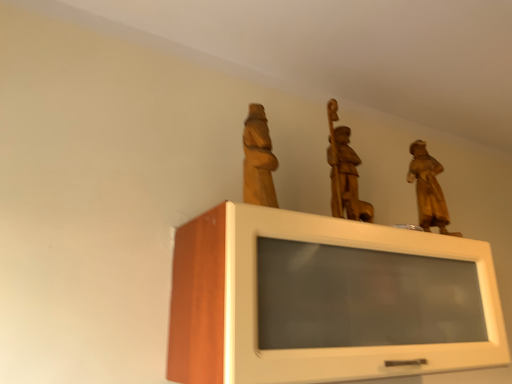
Identify the location of wooden statue at center, arranged as the 2th sculpture when viewed from the right. (344, 172).

Where is `wooden statue at upper right, arranged as the first sculpture when viewed from the right`? wooden statue at upper right, arranged as the first sculpture when viewed from the right is located at coordinates (428, 189).

At what (x,y) coordinates should I click in order to perform the action: click on white glossy cabinet at upper center. Please return your answer as a coordinate pair (x, y). This screenshot has width=512, height=384. Looking at the image, I should click on (325, 300).

Is wooden statue at upper right, the third sculpture positioned from the left, not within wooden statue at upper center, the 3th sculpture in the right-to-left sequence?

Yes, wooden statue at upper right, the third sculpture positioned from the left, is outside of wooden statue at upper center, the 3th sculpture in the right-to-left sequence.

Does wooden statue at upper right, the third sculpture positioned from the left, have a smaller size compared to wooden statue at upper center, placed as the 1th sculpture when sorted from left to right?

No, wooden statue at upper right, the third sculpture positioned from the left, is not smaller than wooden statue at upper center, placed as the 1th sculpture when sorted from left to right.

Considering the sizes of objects wooden statue at upper right, arranged as the first sculpture when viewed from the right, and wooden statue at upper center, the 3th sculpture in the right-to-left sequence, in the image provided, who is thinner, wooden statue at upper right, arranged as the first sculpture when viewed from the right, or wooden statue at upper center, the 3th sculpture in the right-to-left sequence,?

wooden statue at upper center, the 3th sculpture in the right-to-left sequence, is thinner.

Which object is further away from the camera, wooden statue at upper center, placed as the 1th sculpture when sorted from left to right, or white glossy cabinet at upper center?

wooden statue at upper center, placed as the 1th sculpture when sorted from left to right, is more distant.

Between point (269, 200) and point (231, 332), which one is positioned in front?

The point (231, 332) is closer.

Where is `sculpture that is the 1st one when counting backward from the white glossy cabinet at upper center`? The height and width of the screenshot is (384, 512). sculpture that is the 1st one when counting backward from the white glossy cabinet at upper center is located at coordinates (258, 160).

Is wooden statue at upper center, placed as the 1th sculpture when sorted from left to right, completely or partially outside of wooden statue at upper right, the third sculpture positioned from the left?

Indeed, wooden statue at upper center, placed as the 1th sculpture when sorted from left to right, is completely outside wooden statue at upper right, the third sculpture positioned from the left.

In the scene shown: Is wooden statue at upper center, the 3th sculpture in the right-to-left sequence, facing away from wooden statue at upper right, the third sculpture positioned from the left?

No, wooden statue at upper center, the 3th sculpture in the right-to-left sequence,'s orientation is not away from wooden statue at upper right, the third sculpture positioned from the left.

Which point is more distant from viewer, (263, 178) or (446, 216)?

The point (446, 216) is farther.

Is the position of wooden statue at upper center, placed as the 1th sculpture when sorted from left to right, less distant than that of wooden statue at upper right, arranged as the first sculpture when viewed from the right?

Yes, it is.

From a real-world perspective, count 2nd sculptures upward from the wooden statue at upper right, the third sculpture positioned from the left, and point to it. Please provide its 2D coordinates.

[(344, 172)]

Is wooden statue at upper right, arranged as the first sculpture when viewed from the right, facing towards wooden statue at center, which is the 2th sculpture in left-to-right order?

No, wooden statue at upper right, arranged as the first sculpture when viewed from the right, is not aimed at wooden statue at center, which is the 2th sculpture in left-to-right order.

From a real-world perspective, is wooden statue at upper right, arranged as the first sculpture when viewed from the right, positioned under wooden statue at center, arranged as the 2th sculpture when viewed from the right, based on gravity?

Yes, from a real-world perspective, wooden statue at upper right, arranged as the first sculpture when viewed from the right, is under wooden statue at center, arranged as the 2th sculpture when viewed from the right.

Who is bigger, white glossy cabinet at upper center or wooden statue at center, which is the 2th sculpture in left-to-right order?

Bigger between the two is white glossy cabinet at upper center.

Can you confirm if white glossy cabinet at upper center is shorter than wooden statue at center, arranged as the 2th sculpture when viewed from the right?

Incorrect, the height of white glossy cabinet at upper center does not fall short of that of wooden statue at center, arranged as the 2th sculpture when viewed from the right.

Considering the points (290, 327) and (352, 202), which point is in front, point (290, 327) or point (352, 202)?

Positioned in front is point (290, 327).

Is wooden statue at upper right, arranged as the first sculpture when viewed from the right, aimed at white glossy cabinet at upper center?

No, wooden statue at upper right, arranged as the first sculpture when viewed from the right, does not turn towards white glossy cabinet at upper center.

Is wooden statue at upper right, the third sculpture positioned from the left, shorter than white glossy cabinet at upper center?

Yes, wooden statue at upper right, the third sculpture positioned from the left, is shorter than white glossy cabinet at upper center.

From a real-world perspective, is wooden statue at upper right, the third sculpture positioned from the left, positioned under white glossy cabinet at upper center based on gravity?

No, from a real-world perspective, wooden statue at upper right, the third sculpture positioned from the left, is not beneath white glossy cabinet at upper center.

From the image's perspective, would you say wooden statue at upper right, the third sculpture positioned from the left, is positioned over white glossy cabinet at upper center?

Indeed, from the image's perspective, wooden statue at upper right, the third sculpture positioned from the left, is shown above white glossy cabinet at upper center.

In the scene shown: Which object is closer to the camera, wooden statue at center, arranged as the 2th sculpture when viewed from the right, or wooden statue at upper right, the third sculpture positioned from the left?

wooden statue at center, arranged as the 2th sculpture when viewed from the right, is more forward.

Considering the relative sizes of wooden statue at center, arranged as the 2th sculpture when viewed from the right, and wooden statue at upper right, arranged as the first sculpture when viewed from the right, in the image provided, is wooden statue at center, arranged as the 2th sculpture when viewed from the right, bigger than wooden statue at upper right, arranged as the first sculpture when viewed from the right,?

Yes.

Does wooden statue at center, arranged as the 2th sculpture when viewed from the right, have a greater width compared to wooden statue at upper right, the third sculpture positioned from the left?

Correct, the width of wooden statue at center, arranged as the 2th sculpture when viewed from the right, exceeds that of wooden statue at upper right, the third sculpture positioned from the left.

Is wooden statue at center, which is the 2th sculpture in left-to-right order, at the right side of wooden statue at upper right, the third sculpture positioned from the left?

No, wooden statue at center, which is the 2th sculpture in left-to-right order, is not to the right of wooden statue at upper right, the third sculpture positioned from the left.

Locate an element on the screen. The width and height of the screenshot is (512, 384). the 2nd sculpture to the left when counting from the wooden statue at upper right, arranged as the first sculpture when viewed from the right is located at coordinates (x=258, y=160).

Find the location of a particular element. The height and width of the screenshot is (384, 512). furniture in front of the wooden statue at upper center, the 3th sculpture in the right-to-left sequence is located at coordinates (325, 300).

Estimate the real-world distances between objects in this image. Which object is further from wooden statue at upper center, placed as the 1th sculpture when sorted from left to right, wooden statue at center, arranged as the 2th sculpture when viewed from the right, or wooden statue at upper right, the third sculpture positioned from the left?

Among the two, wooden statue at upper right, the third sculpture positioned from the left, is located further to wooden statue at upper center, placed as the 1th sculpture when sorted from left to right.

Based on their spatial positions, is wooden statue at upper right, the third sculpture positioned from the left, or wooden statue at center, arranged as the 2th sculpture when viewed from the right, closer to wooden statue at upper center, the 3th sculpture in the right-to-left sequence?

wooden statue at center, arranged as the 2th sculpture when viewed from the right, is positioned closer to the anchor wooden statue at upper center, the 3th sculpture in the right-to-left sequence.

Considering their positions, is wooden statue at upper center, the 3th sculpture in the right-to-left sequence, positioned closer to wooden statue at upper right, the third sculpture positioned from the left, than wooden statue at center, arranged as the 2th sculpture when viewed from the right?

wooden statue at center, arranged as the 2th sculpture when viewed from the right, is positioned closer to the anchor wooden statue at upper right, the third sculpture positioned from the left.

Estimate the real-world distances between objects in this image. Which object is further from wooden statue at upper right, the third sculpture positioned from the left, wooden statue at upper center, the 3th sculpture in the right-to-left sequence, or white glossy cabinet at upper center?

wooden statue at upper center, the 3th sculpture in the right-to-left sequence, is positioned further to the anchor wooden statue at upper right, the third sculpture positioned from the left.

Looking at the image, which one is located further to wooden statue at upper center, the 3th sculpture in the right-to-left sequence, white glossy cabinet at upper center or wooden statue at upper right, the third sculpture positioned from the left?

Among the two, wooden statue at upper right, the third sculpture positioned from the left, is located further to wooden statue at upper center, the 3th sculpture in the right-to-left sequence.

From the image, which object appears to be nearer to white glossy cabinet at upper center, wooden statue at center, arranged as the 2th sculpture when viewed from the right, or wooden statue at upper center, the 3th sculpture in the right-to-left sequence?

wooden statue at upper center, the 3th sculpture in the right-to-left sequence, lies closer to white glossy cabinet at upper center than the other object.

Based on their spatial positions, is wooden statue at upper center, placed as the 1th sculpture when sorted from left to right, or wooden statue at center, which is the 2th sculpture in left-to-right order, closer to white glossy cabinet at upper center?

wooden statue at upper center, placed as the 1th sculpture when sorted from left to right, is positioned closer to the anchor white glossy cabinet at upper center.

Based on their spatial positions, is wooden statue at upper center, placed as the 1th sculpture when sorted from left to right, or white glossy cabinet at upper center further from wooden statue at center, arranged as the 2th sculpture when viewed from the right?

white glossy cabinet at upper center lies further to wooden statue at center, arranged as the 2th sculpture when viewed from the right, than the other object.

You are a GUI agent. You are given a task and a screenshot of the screen. Output one action in this format:
    pyautogui.click(x=<x>, y=<y>)
    Task: Click on the sculpture between wooden statue at upper center, placed as the 1th sculpture when sorted from left to right, and wooden statue at upper right, arranged as the first sculpture when viewed from the right
    The image size is (512, 384).
    Given the screenshot: What is the action you would take?
    pyautogui.click(x=344, y=172)

I want to click on furniture located between wooden statue at upper center, the 3th sculpture in the right-to-left sequence, and wooden statue at upper right, arranged as the first sculpture when viewed from the right, in the left-right direction, so (x=325, y=300).